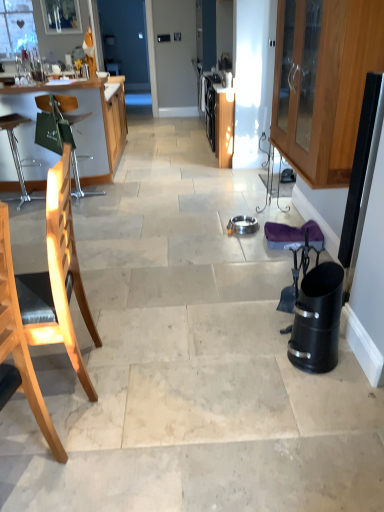
The height and width of the screenshot is (512, 384). Identify the location of vacant space underneath light wood chair at left, the second chair positioned from the front (from a real-world perspective). (53, 376).